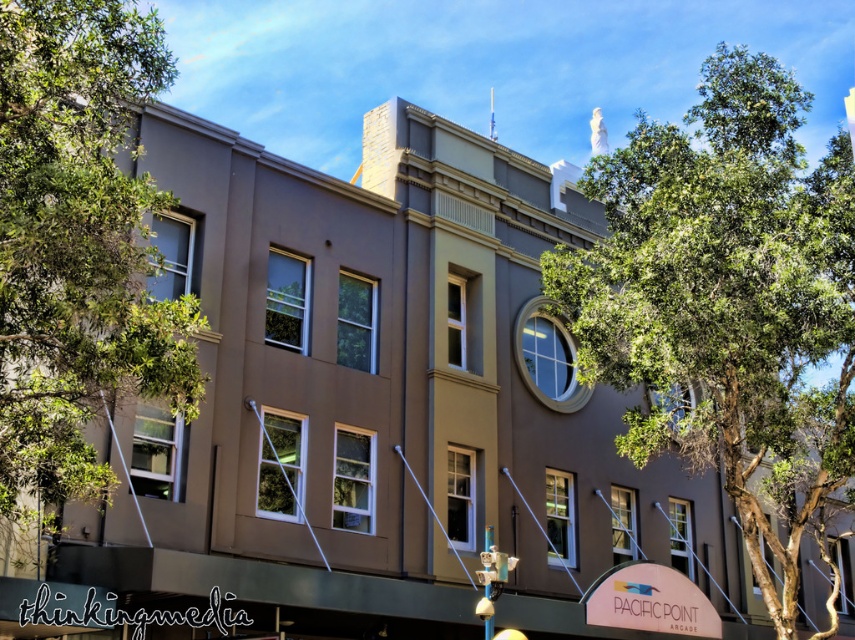
Looking at this image, you are standing at the base of the multi story building and want to take a photo of the point at coordinate (693, 176). Your camera has a maximum zoom range of 40 meters. Will you be able to capture the point in your photo?

The point at coordinate (693, 176) is 42.42 meters from the camera, which exceeds the maximum zoom range of 40 meters. Therefore, you will not be able to capture the point in your photo.

You are standing in front of the building and notice two points marked on the facade. The first point is located at coordinates point (764, 584) and the second at point (96, 492). Which point is closer to the roofline?

Point (764, 584) is behind point (96, 492), so the point closer to the roofline would be point (764, 584) since it is positioned higher on the building facade.

You are a photographer trying to capture the building with both the green leafy tree at upper right and the green leafy tree at left in the frame. Which tree is closer to the building?

The green leafy tree at upper right is positioned over the green leafy tree at left, meaning it is closer to the building than the other tree.